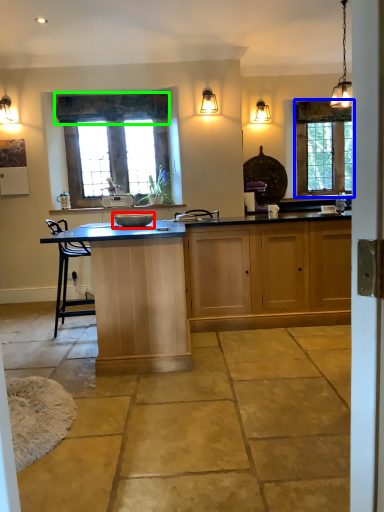
Question: Based on their relative distances, which object is nearer to appliance (highlighted by a red box)? Choose from window (highlighted by a blue box) and curtain (highlighted by a green box).

Choices:
 (A) window
 (B) curtain

Answer: (B)